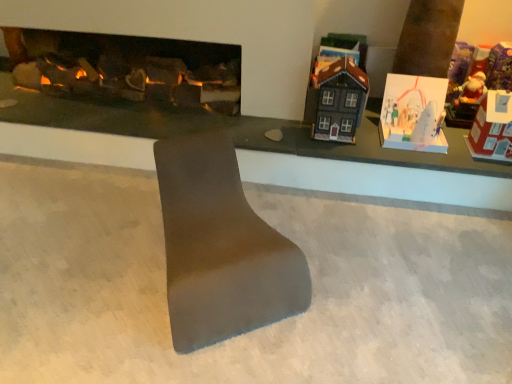
Question: Is white paper card at upper right, acting as the second toy starting from the right, to the left of matte black house at upper right, placed as the 2th toy when sorted from left to right, from the viewer's perspective?

Choices:
 (A) no
 (B) yes

Answer: (A)

Question: Is white paper card at upper right, acting as the second toy starting from the right, directly adjacent to matte black house at upper right, the third toy positioned from the right?

Choices:
 (A) yes
 (B) no

Answer: (B)

Question: Is white paper card at upper right, acting as the second toy starting from the right, bigger than matte black house at upper right, placed as the 2th toy when sorted from left to right?

Choices:
 (A) yes
 (B) no

Answer: (A)

Question: From a real-world perspective, is white paper card at upper right, the 3th toy in the left-to-right sequence, on matte black house at upper right, the third toy positioned from the right?

Choices:
 (A) no
 (B) yes

Answer: (A)

Question: Is white paper card at upper right, acting as the second toy starting from the right, aimed at matte black house at upper right, placed as the 2th toy when sorted from left to right?

Choices:
 (A) no
 (B) yes

Answer: (A)

Question: Considering the relative sizes of white paper card at upper right, acting as the second toy starting from the right, and matte black house at upper right, placed as the 2th toy when sorted from left to right, in the image provided, is white paper card at upper right, acting as the second toy starting from the right, thinner than matte black house at upper right, placed as the 2th toy when sorted from left to right,?

Choices:
 (A) yes
 (B) no

Answer: (B)

Question: Is white paper card at upper right, acting as the second toy starting from the right, smaller than matte gray footrest at center?

Choices:
 (A) no
 (B) yes

Answer: (B)

Question: Is white paper card at upper right, acting as the second toy starting from the right, facing towards matte gray footrest at center?

Choices:
 (A) no
 (B) yes

Answer: (A)

Question: Is matte gray footrest at center a part of white paper card at upper right, acting as the second toy starting from the right?

Choices:
 (A) yes
 (B) no

Answer: (B)

Question: Considering the relative sizes of white paper card at upper right, acting as the second toy starting from the right, and matte gray footrest at center in the image provided, is white paper card at upper right, acting as the second toy starting from the right, shorter than matte gray footrest at center?

Choices:
 (A) no
 (B) yes

Answer: (B)

Question: From the image's perspective, is white paper card at upper right, acting as the second toy starting from the right, located beneath matte gray footrest at center?

Choices:
 (A) no
 (B) yes

Answer: (A)

Question: Are white paper card at upper right, acting as the second toy starting from the right, and matte gray footrest at center beside each other?

Choices:
 (A) yes
 (B) no

Answer: (B)

Question: From a real-world perspective, is matte black house at upper right, the third toy positioned from the right, under dark gray matte house at upper right, the first toy in the left-to-right sequence?

Choices:
 (A) no
 (B) yes

Answer: (B)